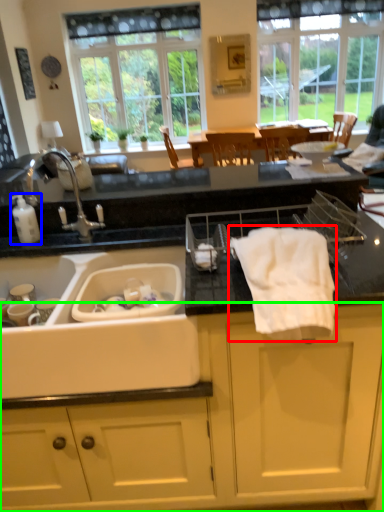
Question: Considering the real-world distances, which object is farthest from bath towel (highlighted by a red box)? toiletry (highlighted by a blue box) or cabinetry (highlighted by a green box)?

Choices:
 (A) toiletry
 (B) cabinetry

Answer: (A)